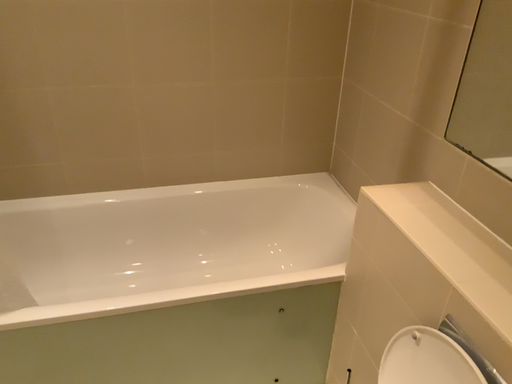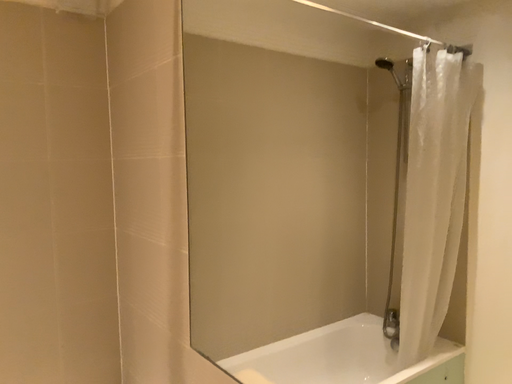
Question: Which way did the camera rotate in the video?

Choices:
 (A) rotated right
 (B) rotated left

Answer: (A)